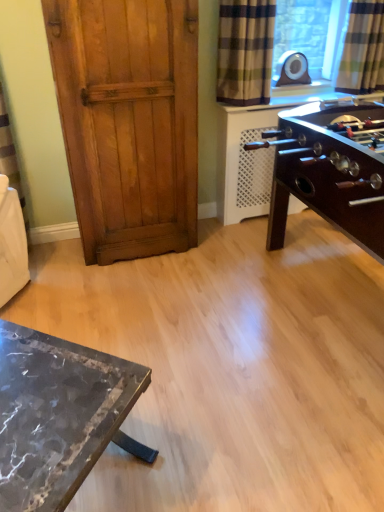
This screenshot has width=384, height=512. Find the location of `vacant area that is in front of wooden door at left`. vacant area that is in front of wooden door at left is located at coordinates (130, 291).